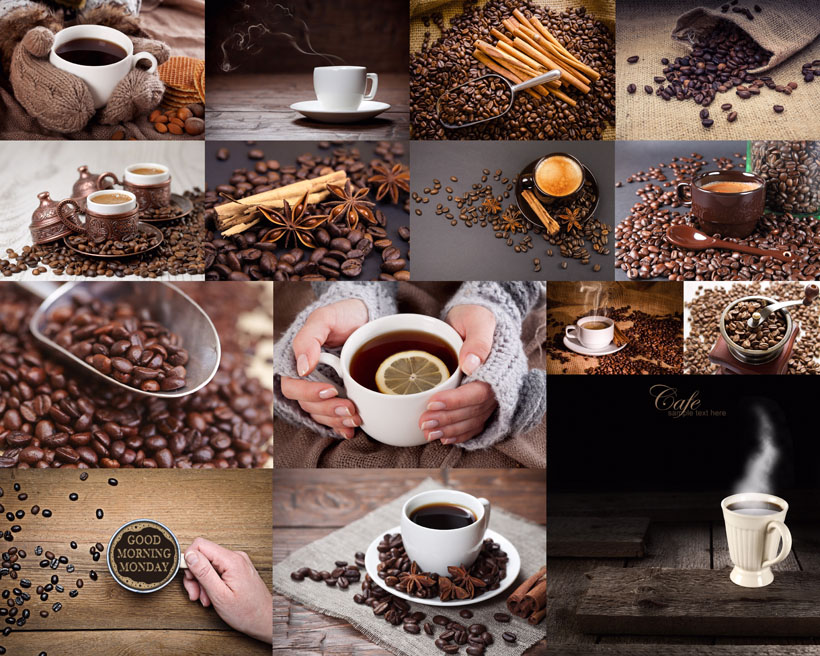
Find the location of a particular element. coffee inside cup is located at coordinates (371, 344), (426, 504), (754, 502), (727, 184), (556, 176), (85, 42), (102, 191), (144, 163).